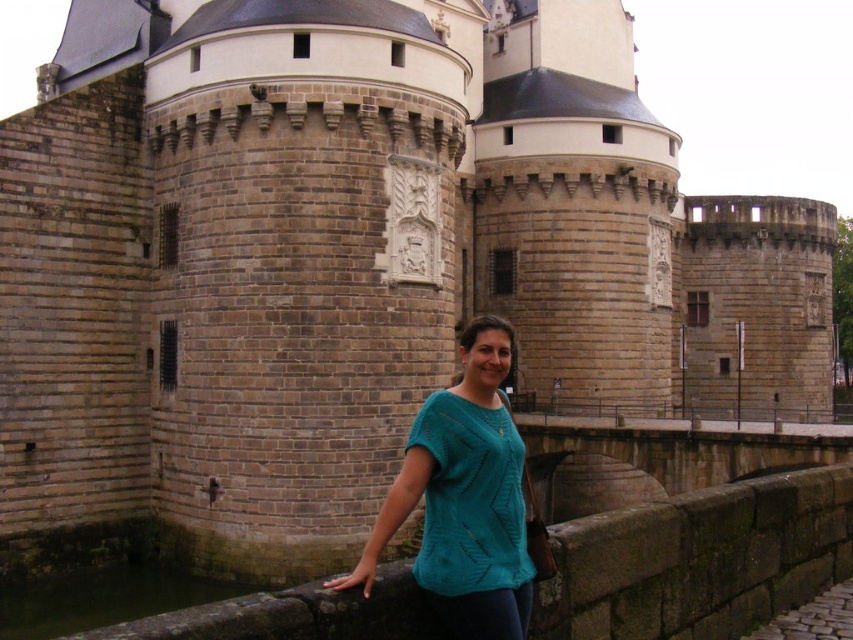
Question: Can you confirm if teal knitted shirt at center is bigger than dark brown water at lower left?

Choices:
 (A) yes
 (B) no

Answer: (A)

Question: Which point is closer to the camera?

Choices:
 (A) (463, 627)
 (B) (25, 582)

Answer: (A)

Question: Can you confirm if teal knitted shirt at center is positioned above dark brown water at lower left?

Choices:
 (A) yes
 (B) no

Answer: (A)

Question: Does teal knitted shirt at center have a lesser width compared to dark brown water at lower left?

Choices:
 (A) no
 (B) yes

Answer: (B)

Question: Which point is farther to the camera?

Choices:
 (A) dark brown water at lower left
 (B) teal knitted shirt at center

Answer: (A)